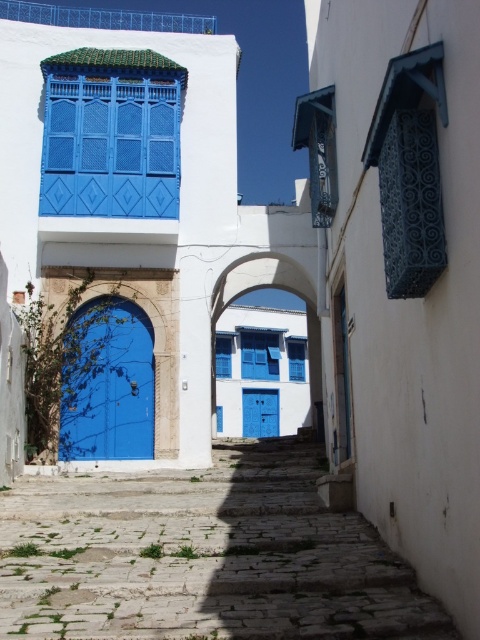
Question: Which point is farther to the camera?

Choices:
 (A) stone cobblestone stairs at center
 (B) white stone archway at center

Answer: (B)

Question: In this image, where is stone cobblestone stairs at center located relative to blue glossy door at center?

Choices:
 (A) above
 (B) below

Answer: (B)

Question: Does stone cobblestone stairs at center have a smaller size compared to blue matte door at center?

Choices:
 (A) no
 (B) yes

Answer: (A)

Question: Among these points, which one is farthest from the camera?

Choices:
 (A) click(x=303, y=509)
 (B) click(x=286, y=320)
 (C) click(x=264, y=428)
 (D) click(x=110, y=353)

Answer: (B)

Question: Which point is farther to the camera?

Choices:
 (A) blue glossy door at center
 (B) white stone archway at center
 (C) blue matte door at center
 (D) stone cobblestone stairs at center

Answer: (C)

Question: Is stone cobblestone stairs at center below blue matte door at center?

Choices:
 (A) no
 (B) yes

Answer: (A)